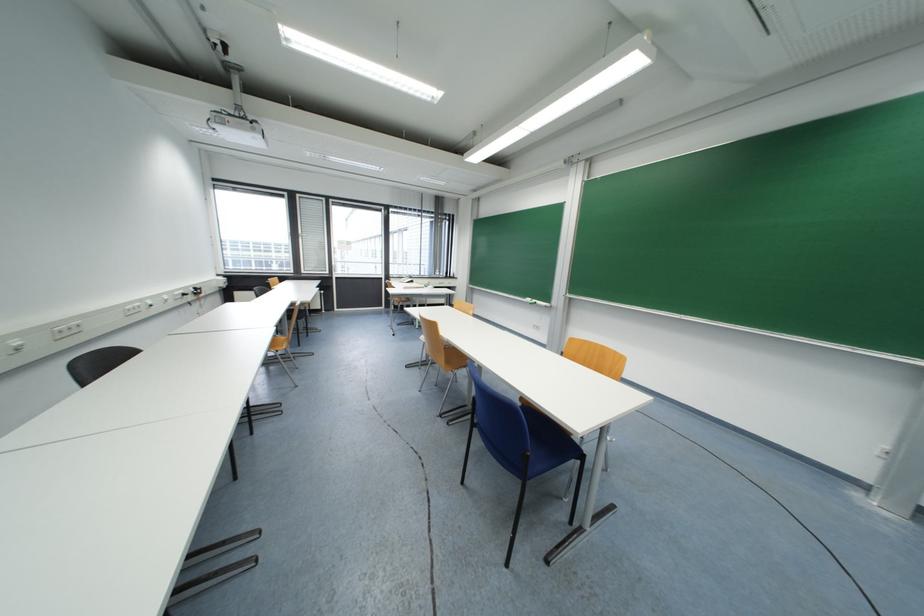
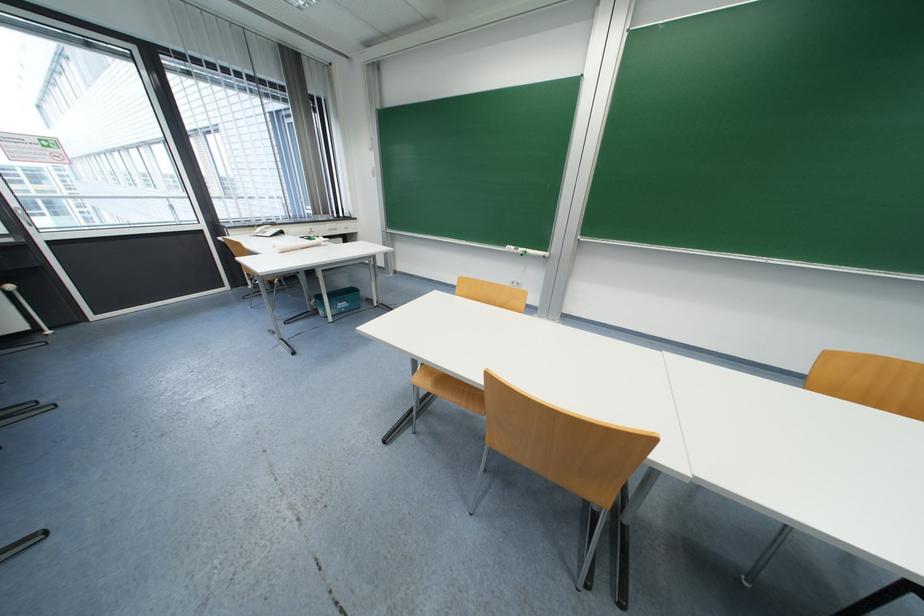
Where in the second image is the point corresponding to point 416,278 from the first image?

(277, 225)